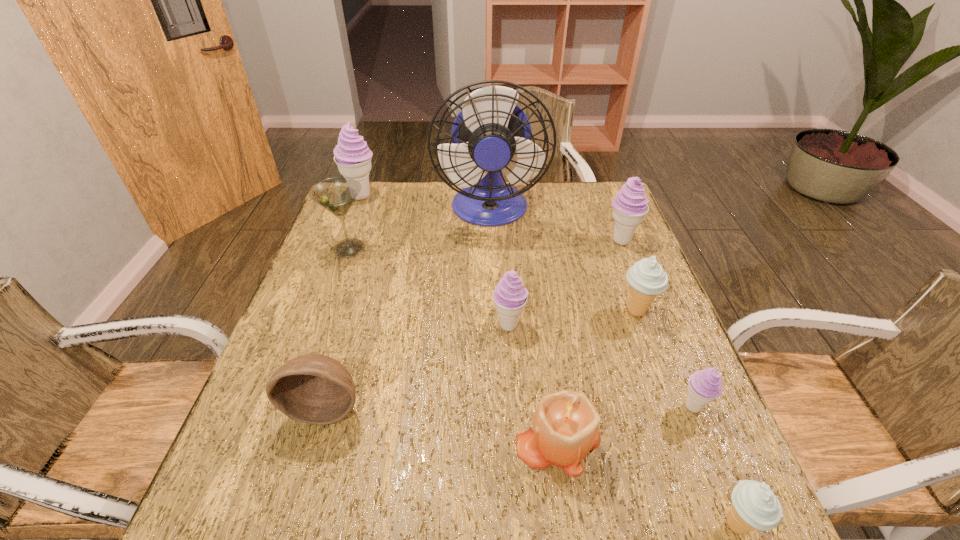
Where is `fan`? fan is located at coordinates (491, 135).

The width and height of the screenshot is (960, 540). Find the location of `the farthest icecream`. the farthest icecream is located at coordinates (353, 157).

In order to click on the leftmost icecream in this screenshot , I will do `click(353, 157)`.

Identify the location of martini. (337, 194).

Find the location of a particular element. The height and width of the screenshot is (540, 960). the third smallest purple icecream is located at coordinates (630, 206).

You are a GUI agent. You are given a task and a screenshot of the screen. Output one action in this format:
    pyautogui.click(x=<x>, y=<y>)
    Task: Click on the second farthest icecream
    The width and height of the screenshot is (960, 540).
    Given the screenshot: What is the action you would take?
    pyautogui.click(x=630, y=206)

The width and height of the screenshot is (960, 540). I want to click on the bigger beige icecream, so click(646, 277).

Where is `the third biggest purple icecream`? Image resolution: width=960 pixels, height=540 pixels. the third biggest purple icecream is located at coordinates (510, 296).

Find the location of a particular element. Image resolution: width=960 pixels, height=540 pixels. the second purple icecream from left to right is located at coordinates point(510,296).

Locate an element on the screen. bowl is located at coordinates (313, 388).